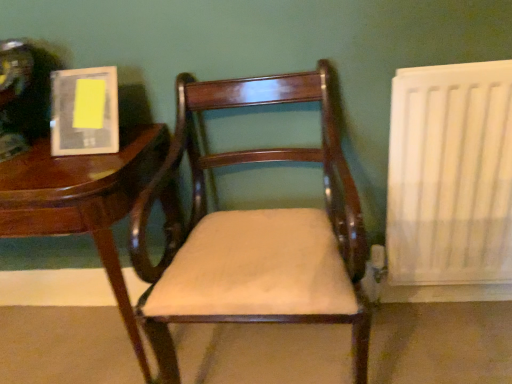
Where is `free region on the left part of white matte radiator at right`? Image resolution: width=512 pixels, height=384 pixels. free region on the left part of white matte radiator at right is located at coordinates (382, 339).